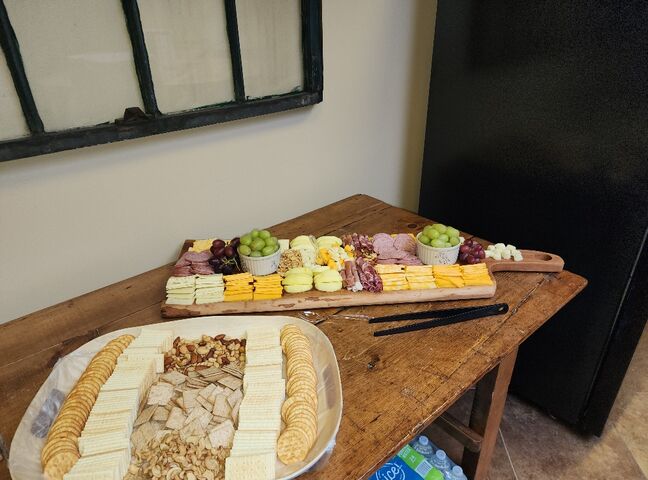
At what (x,y) coordinates should I click in order to perform the action: click on table. Please return your answer as a coordinate pair (x, y). The height and width of the screenshot is (480, 648). Looking at the image, I should click on pyautogui.click(x=421, y=362).